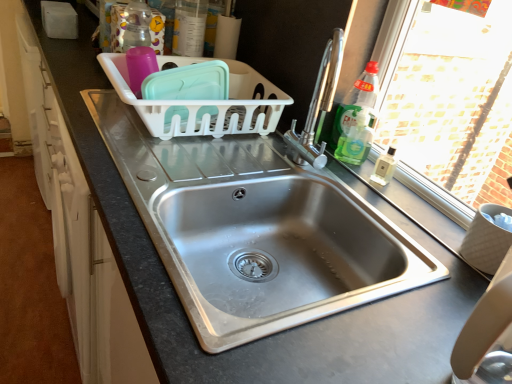
Question: Does stainless steel sink at center, the second sink in the top-to-bottom sequence, have a lesser height compared to translucent plastic container at upper center, the 1th bottle in the top-to-bottom sequence?

Choices:
 (A) yes
 (B) no

Answer: (B)

Question: Can you see stainless steel sink at center, the first sink in the bottom-to-top sequence, touching translucent plastic container at upper center, the 3th bottle when ordered from bottom to top?

Choices:
 (A) no
 (B) yes

Answer: (A)

Question: Is stainless steel sink at center, the second sink in the top-to-bottom sequence, thinner than translucent plastic container at upper center, arranged as the third bottle when viewed from the right?

Choices:
 (A) no
 (B) yes

Answer: (A)

Question: Is stainless steel sink at center, the first sink in the bottom-to-top sequence, turned away from translucent plastic container at upper center, arranged as the third bottle when viewed from the right?

Choices:
 (A) no
 (B) yes

Answer: (A)

Question: Considering the relative positions of stainless steel sink at center, the first sink in the bottom-to-top sequence, and translucent plastic container at upper center, which appears as the 1th bottle when viewed from the left, in the image provided, is stainless steel sink at center, the first sink in the bottom-to-top sequence, to the right of translucent plastic container at upper center, which appears as the 1th bottle when viewed from the left, from the viewer's perspective?

Choices:
 (A) yes
 (B) no

Answer: (A)

Question: From their relative heights in the image, would you say white plastic basket at center is taller or shorter than translucent plastic container at upper center, the 1th bottle in the top-to-bottom sequence?

Choices:
 (A) tall
 (B) short

Answer: (B)

Question: Visually, is white plastic basket at center positioned to the left or to the right of translucent plastic container at upper center, arranged as the third bottle when viewed from the right?

Choices:
 (A) left
 (B) right

Answer: (B)

Question: Based on their sizes in the image, would you say white plastic basket at center is bigger or smaller than translucent plastic container at upper center, which appears as the 1th bottle when viewed from the left?

Choices:
 (A) big
 (B) small

Answer: (A)

Question: From the image's perspective, is white plastic basket at center above or below translucent plastic container at upper center, arranged as the third bottle when viewed from the right?

Choices:
 (A) above
 (B) below

Answer: (B)

Question: Is green translucent soap dispenser at right, which is the 3th bottle from left to right, spatially inside stainless steel sink at center, positioned as the 2th sink in bottom-to-top order, or outside of it?

Choices:
 (A) inside
 (B) outside

Answer: (B)

Question: In the image, is green translucent soap dispenser at right, which is the 3th bottle from left to right, positioned in front of or behind stainless steel sink at center, positioned as the 2th sink in bottom-to-top order?

Choices:
 (A) front
 (B) behind

Answer: (B)

Question: From the image's perspective, is green translucent soap dispenser at right, which is counted as the 3th bottle, starting from the top, above or below stainless steel sink at center, the first sink from the top?

Choices:
 (A) below
 (B) above

Answer: (B)

Question: Is point (356, 112) positioned closer to the camera than point (282, 263)?

Choices:
 (A) closer
 (B) farther

Answer: (B)

Question: Based on their positions, is white plastic basket at center located to the left or right of green glass bottle at upper right, which ranks as the 2th bottle in bottom-to-top order?

Choices:
 (A) right
 (B) left

Answer: (B)

Question: In terms of height, does white plastic basket at center look taller or shorter compared to green glass bottle at upper right, which ranks as the 2th bottle in bottom-to-top order?

Choices:
 (A) short
 (B) tall

Answer: (A)